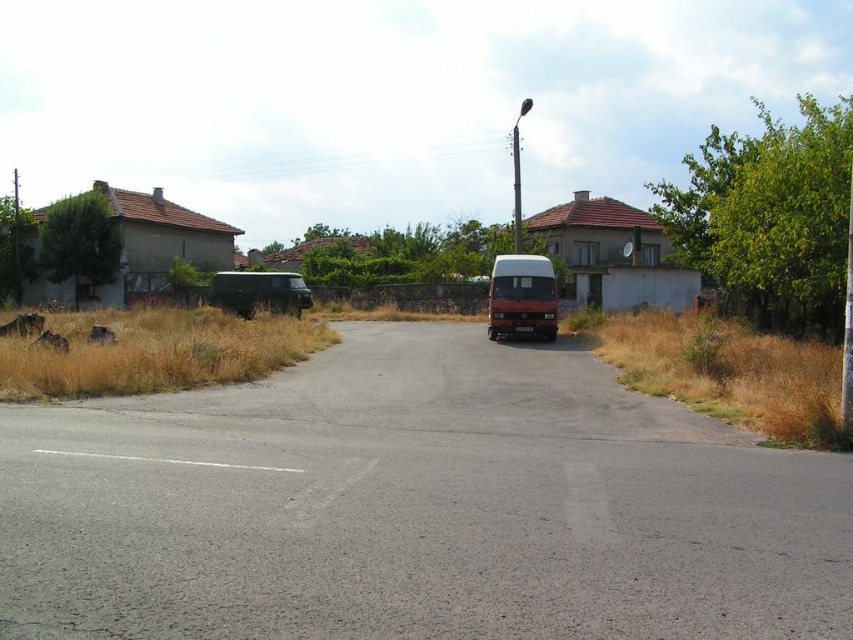
You are a delivery driver who needs to park your truck between the black matte van at center and the matte red van at center. Which van should you park behind to ensure your truck fits vertically in the space?

You should park behind the matte red van at center because it is taller than the black matte van at center, providing more vertical clearance for your truck.

You are a delivery driver who needs to park your 4.5 meters long truck behind the black matte van at center. Is there enough space between the van and the camera to park your truck?

The black matte van at center is 4.03 meters away from the camera. Since your truck is 4.5 meters long, there isn not enough space between the van and the camera to park your truck.